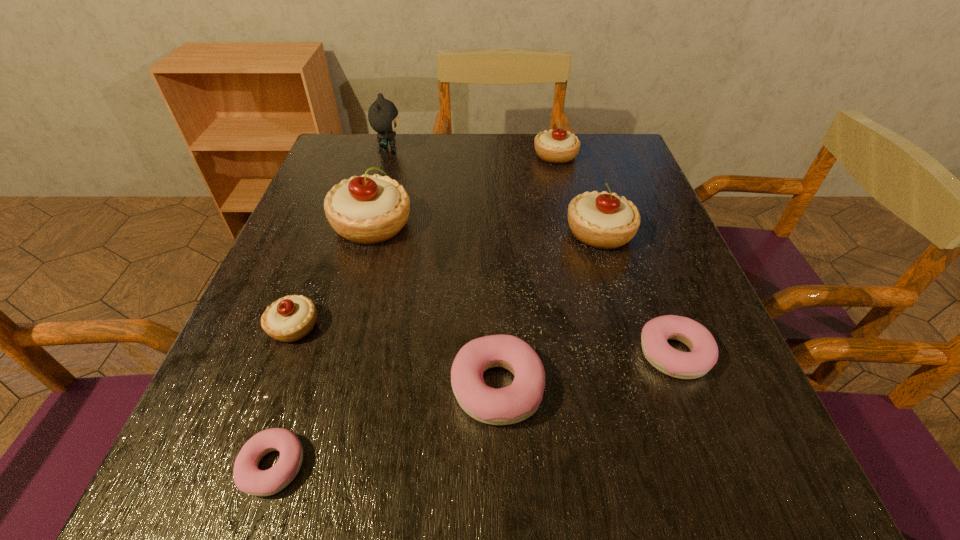
You are a GUI agent. You are given a task and a screenshot of the screen. Output one action in this format:
    pyautogui.click(x=<x>, y=<y>)
    Task: Click on the vacant space positioned on the front of the second shortest pastry
    
    Given the screenshot: What is the action you would take?
    pyautogui.click(x=714, y=460)

Identify the location of free location located 0.190m on the right of the smallest pink pastry. Image resolution: width=960 pixels, height=540 pixels. (444, 466).

Find the location of `kitten present at the far edge`. kitten present at the far edge is located at coordinates (383, 117).

Where is `pastry that is at the far edge`? The width and height of the screenshot is (960, 540). pastry that is at the far edge is located at coordinates (558, 146).

The image size is (960, 540). In order to click on object that is positioned at the near edge in this screenshot , I will do `click(249, 479)`.

Image resolution: width=960 pixels, height=540 pixels. In order to click on kitten at the left edge in this screenshot , I will do `click(383, 117)`.

Where is `object present at the far left corner`? This screenshot has height=540, width=960. object present at the far left corner is located at coordinates (383, 117).

Identify the location of object positioned at the near left corner. (249, 479).

The height and width of the screenshot is (540, 960). In order to click on object that is positioned at the far right corner in this screenshot , I will do `click(558, 146)`.

Locate an element on the screen. The height and width of the screenshot is (540, 960). vacant space at the far edge is located at coordinates (439, 136).